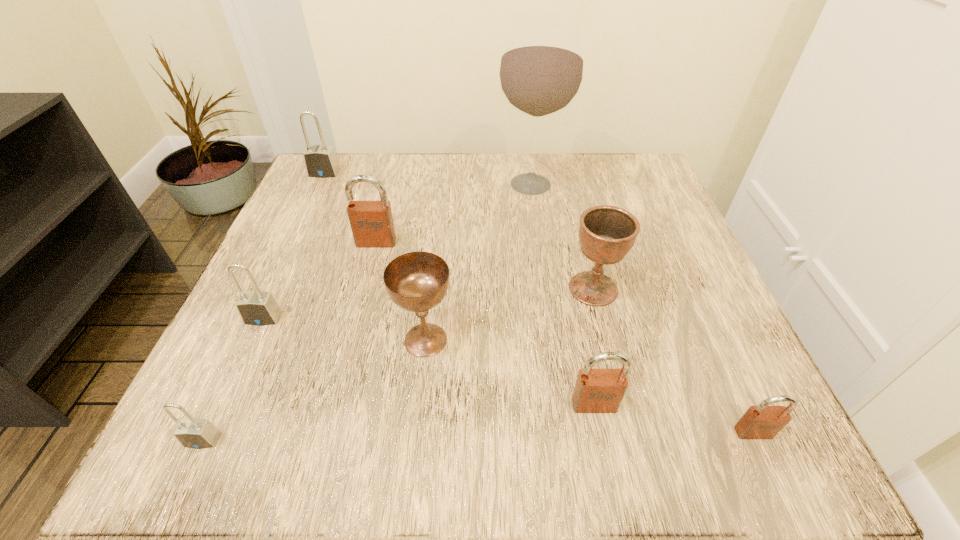
Locate which gray padlock is the second closest to the left chalice. Please provide its 2D coordinates. Your answer should be formatted as a tuple, i.e. [(x, y)], where the tuple contains the x and y coordinates of a point satisfying the conditions above.

[(194, 433)]

Locate which gray padlock is the second closest to the second farthest gray padlock. Please provide its 2D coordinates. Your answer should be formatted as a tuple, i.e. [(x, y)], where the tuple contains the x and y coordinates of a point satisfying the conditions above.

[(320, 161)]

I want to click on brown padlock object that ranks as the second closest to the second biggest brown padlock, so click(371, 222).

Where is `brown padlock object that ranks as the second closest to the rightmost padlock`? This screenshot has width=960, height=540. brown padlock object that ranks as the second closest to the rightmost padlock is located at coordinates (371, 222).

Find the location of a particular element. The height and width of the screenshot is (540, 960). vacant space that satisfies the following two spatial constraints: 1. on the shackle of the biggest gray padlock; 2. on the left side of the nearer chalice is located at coordinates (247, 340).

At what (x,y) coordinates should I click in order to perform the action: click on vacant space that satisfies the following two spatial constraints: 1. on the front-facing side of the farthest brown padlock; 2. on the left side of the left chalice. Please return your answer as a coordinate pair (x, y). This screenshot has height=540, width=960. Looking at the image, I should click on (351, 340).